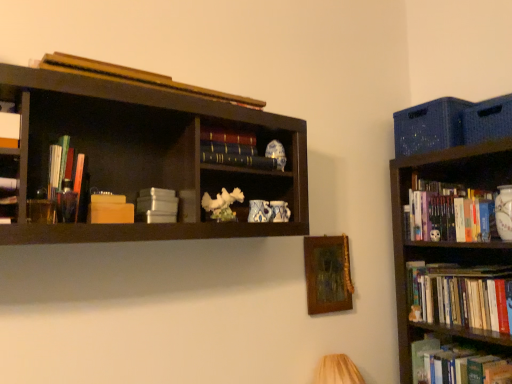
Question: Is hardcover book at center, the fourth book viewed from the right, smaller than white matte book at upper left, acting as the first book starting from the left?

Choices:
 (A) yes
 (B) no

Answer: (A)

Question: Is hardcover book at center, the fourth book viewed from the right, placed right next to white matte book at upper left, acting as the second book starting from the top?

Choices:
 (A) yes
 (B) no

Answer: (B)

Question: Would you say hardcover book at center, which is the 6th book in bottom-to-top order, contains white matte book at upper left, acting as the first book starting from the left?

Choices:
 (A) no
 (B) yes

Answer: (A)

Question: Is hardcover book at center, which is the third book in top-to-bottom order, not within white matte book at upper left, acting as the second book starting from the top?

Choices:
 (A) yes
 (B) no

Answer: (A)

Question: Is hardcover book at center, which is the 5th book in left-to-right order, to the left of white matte book at upper left, acting as the second book starting from the top, from the viewer's perspective?

Choices:
 (A) no
 (B) yes

Answer: (A)

Question: Would you say hardcover books at right, the 6th book in the left-to-right sequence, is to the left or to the right of wooden picture frame at center in the picture?

Choices:
 (A) left
 (B) right

Answer: (B)

Question: Does point (449, 190) appear closer or farther from the camera than point (328, 276)?

Choices:
 (A) closer
 (B) farther

Answer: (B)

Question: Considering their positions, is hardcover books at right, the 6th book in the left-to-right sequence, located in front of or behind wooden picture frame at center?

Choices:
 (A) front
 (B) behind

Answer: (B)

Question: From a real-world perspective, is hardcover books at right, the third book in the bottom-to-top sequence, above or below wooden picture frame at center?

Choices:
 (A) below
 (B) above

Answer: (B)

Question: Is hardcover book at center, the fourth book viewed from the right, wider or thinner than wooden book at upper center, the 1th book when ordered from top to bottom?

Choices:
 (A) thin
 (B) wide

Answer: (A)

Question: In the image, is hardcover book at center, the fourth book viewed from the right, positioned in front of or behind wooden book at upper center, which appears as the 5th book when viewed from the right?

Choices:
 (A) behind
 (B) front

Answer: (A)

Question: From a real-world perspective, is hardcover book at center, which is the 5th book in left-to-right order, physically located above or below wooden book at upper center, which appears as the 5th book when viewed from the right?

Choices:
 (A) above
 (B) below

Answer: (B)

Question: From the image's perspective, relative to wooden book at upper center, which appears as the 5th book when viewed from the right, is hardcover book at center, which is the 5th book in left-to-right order, above or below?

Choices:
 (A) above
 (B) below

Answer: (B)

Question: Is point (460, 369) closer or farther from the camera than point (15, 124)?

Choices:
 (A) farther
 (B) closer

Answer: (A)

Question: Considering their positions, is hardcover book at lower right, the seventh book in the left-to-right sequence, located in front of or behind white matte book at upper left, which is the eighth book from right to left?

Choices:
 (A) behind
 (B) front

Answer: (A)